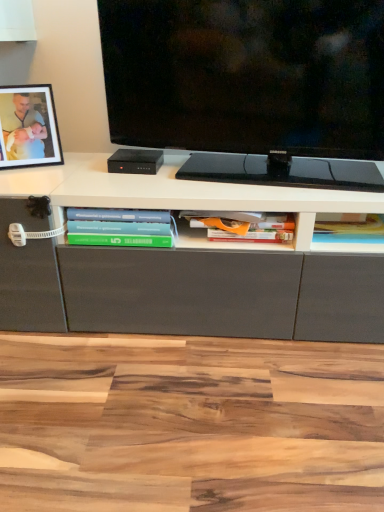
Question: Considering the positions of black glossy tv at center and black matte picture frame at upper left in the image, is black glossy tv at center bigger or smaller than black matte picture frame at upper left?

Choices:
 (A) big
 (B) small

Answer: (A)

Question: Is black glossy tv at center wider or thinner than black matte picture frame at upper left?

Choices:
 (A) wide
 (B) thin

Answer: (A)

Question: Which of these objects is positioned closest to the hardcover book at center, the third book positioned from the left?

Choices:
 (A) green matte book at lower left, marked as the 3th book in a right-to-left arrangement
 (B) black matte picture frame at upper left
 (C) orange matte book at center, the second book from the right
 (D) black glossy tv at center

Answer: (C)

Question: Estimate the real-world distances between objects in this image. Which object is farther from the orange matte book at center, the second book from the right?

Choices:
 (A) black matte picture frame at upper left
 (B) hardcover book at center, the third book positioned from the left
 (C) green matte book at lower left, which is the 1th book from left to right
 (D) black glossy tv at center

Answer: (A)